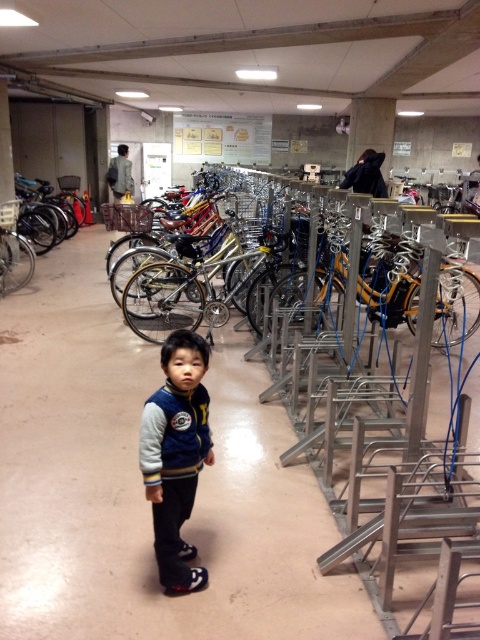
You are a maintenance worker in the bicycle parking area. You need to locate the shiny metallic bicycle at center. What are its coordinates?

The shiny metallic bicycle at center is located at coordinates point (206, 275).